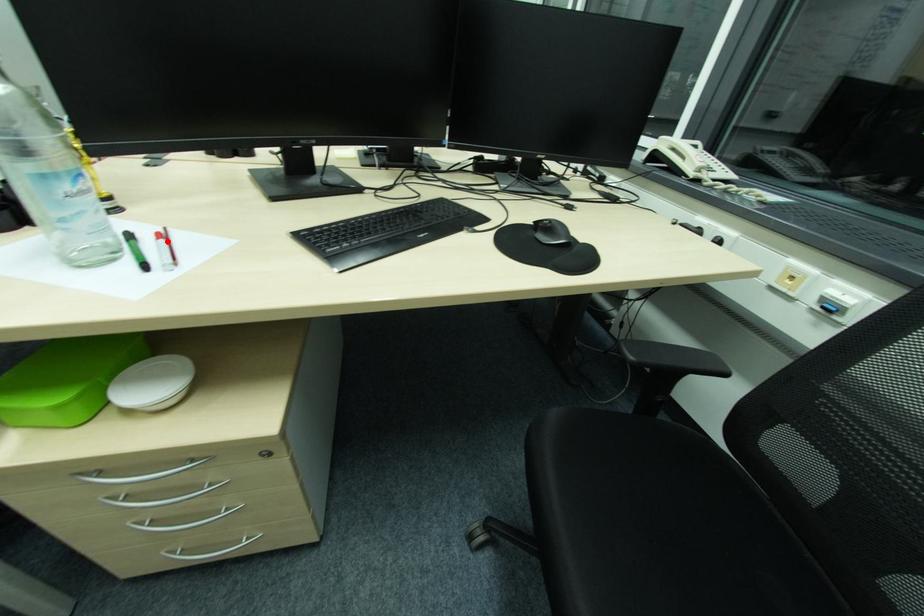
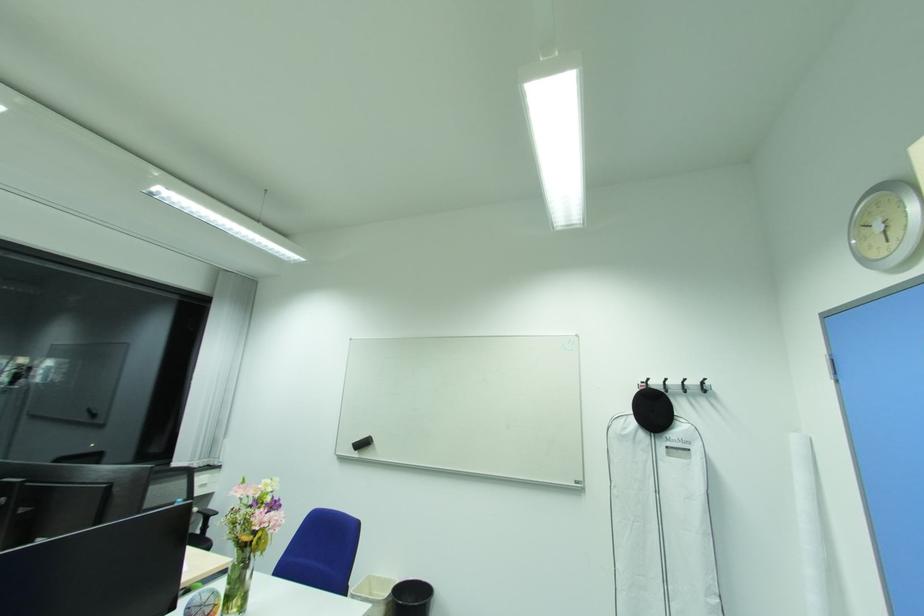
Question: I am providing you with two images of the same scene from different viewpoints. A red point is marked on the first image. Can you still see the location of the red point in image 2?

Choices:
 (A) Yes
 (B) No

Answer: (B)